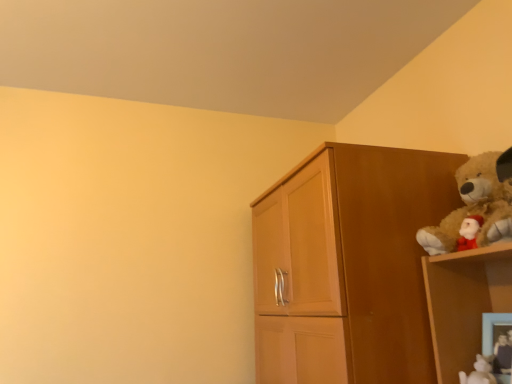
Question: Considering the positions of fuzzy brown teddy bear at upper right and white glossy figurine at lower right, the first toy viewed from the left, in the image, is fuzzy brown teddy bear at upper right taller or shorter than white glossy figurine at lower right, the first toy viewed from the left,?

Choices:
 (A) tall
 (B) short

Answer: (A)

Question: Based on their sizes in the image, would you say fuzzy brown teddy bear at upper right is bigger or smaller than white glossy figurine at lower right, the 2th toy positioned from the right?

Choices:
 (A) big
 (B) small

Answer: (A)

Question: Which is nearer to the wooden cupboard at right?

Choices:
 (A) fuzzy brown teddy bear at upper right
 (B) velvety plush bear at upper right, acting as the first toy starting from the right
 (C) wooden picture frame at lower right
 (D) white glossy figurine at lower right, the first toy viewed from the left

Answer: (A)

Question: Estimate the real-world distances between objects in this image. Which object is closer to the white glossy figurine at lower right, the first toy viewed from the left?

Choices:
 (A) fuzzy brown teddy bear at upper right
 (B) wooden cupboard at right
 (C) velvety plush bear at upper right, acting as the first toy starting from the right
 (D) wooden picture frame at lower right

Answer: (C)